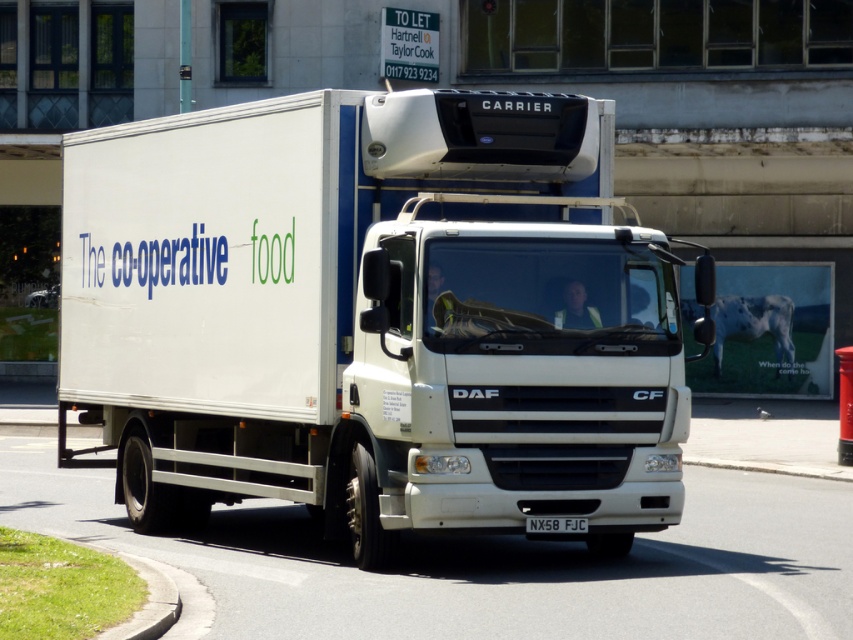
You are a traffic officer observing a white matte truck at center and a white plastic license plate at center in the image. Which object is located more to the left?

The white matte truck at center is positioned on the left side of white plastic license plate at center, so it is more to the left.